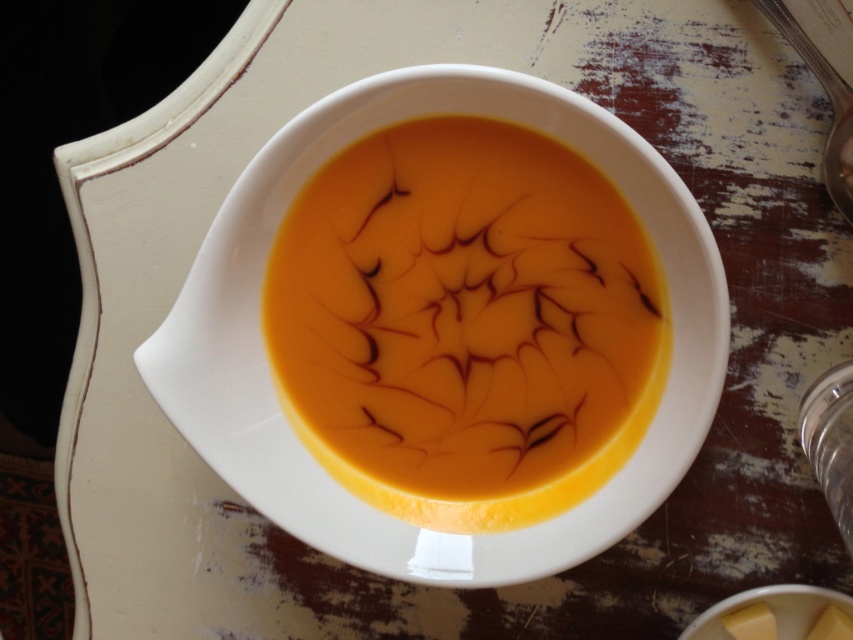
Which is more to the right, orange smoothie at center or metallic silver spoon at upper right?

Positioned to the right is metallic silver spoon at upper right.

Looking at this image, between orange smoothie at center and metallic silver spoon at upper right, which one is positioned higher?

metallic silver spoon at upper right is higher up.

Is point (483, 372) positioned before point (844, 198)?

Yes, it is.

Where is `orange smoothie at center`? This screenshot has height=640, width=853. orange smoothie at center is located at coordinates (465, 323).